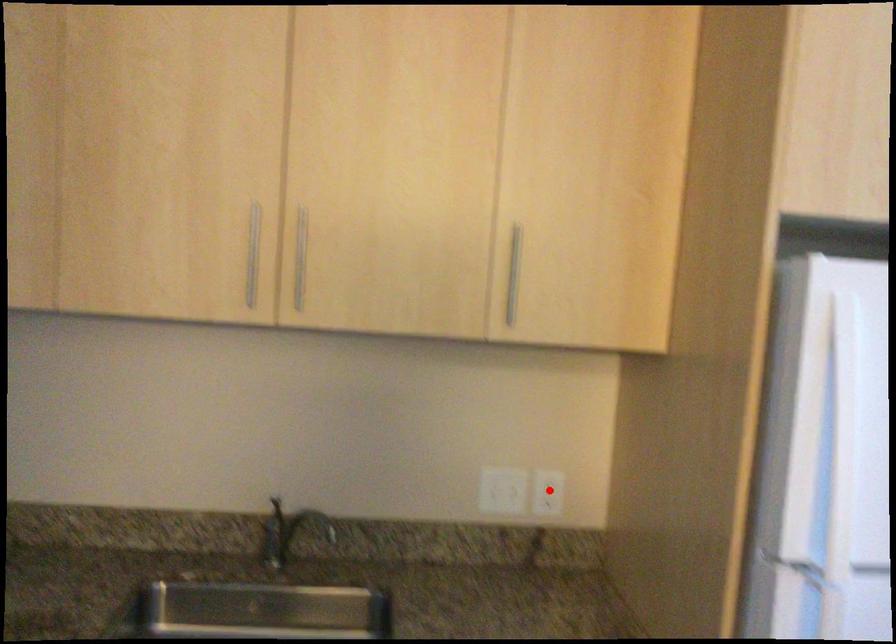
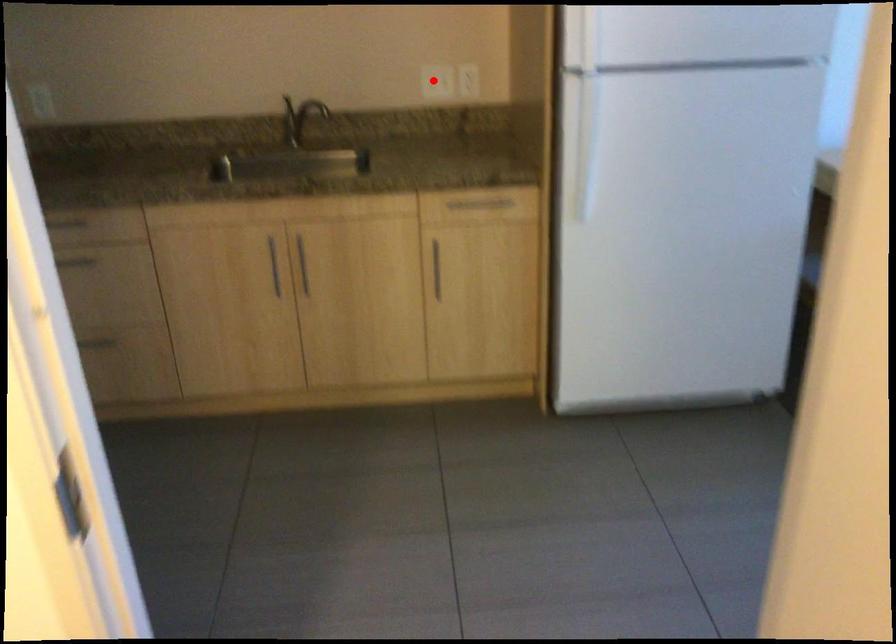
I am providing you with two images of the same scene from different viewpoints. A red point is marked on the first image and another point is marked on the second image. Is the marked point in image1 the same physical position as the marked point in image2?

No